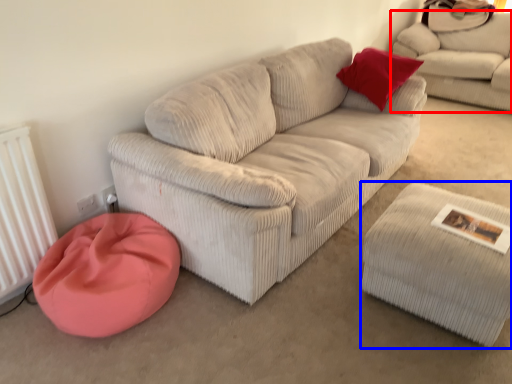
Question: Which of the following is the farthest to the observer, studio couch (highlighted by a red box) or stool (highlighted by a blue box)?

Choices:
 (A) studio couch
 (B) stool

Answer: (A)